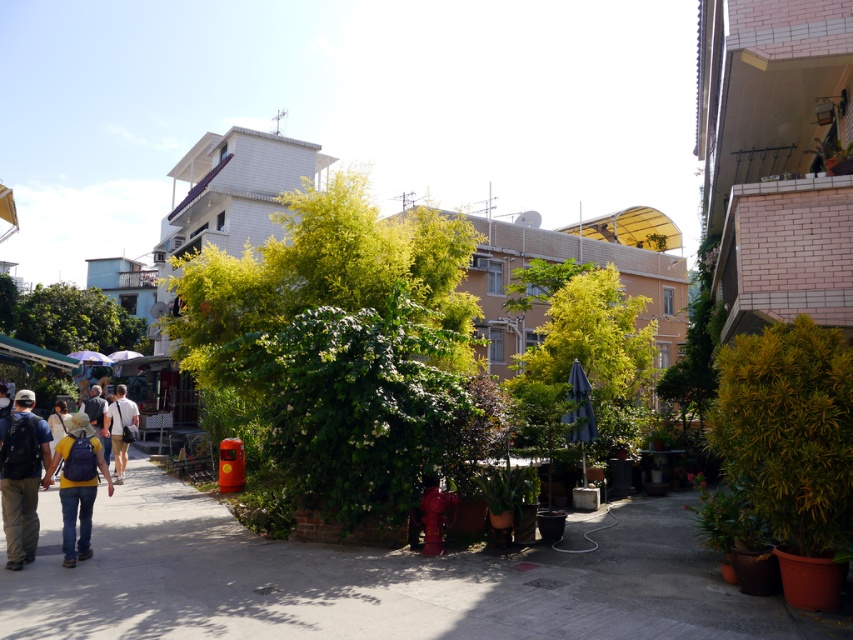
Looking at this image, you are a photographer standing at the camera position in the scene. You want to capture a closeup shot of the denim jeans at lower left. Given that your camera can focus on objects within 20 feet, will you be able to take the closeup without moving closer?

The denim jeans at lower left are 24.12 feet away from the camera, which is beyond the 20 feet focusing range. Therefore, you cannot take the closeup without moving closer.